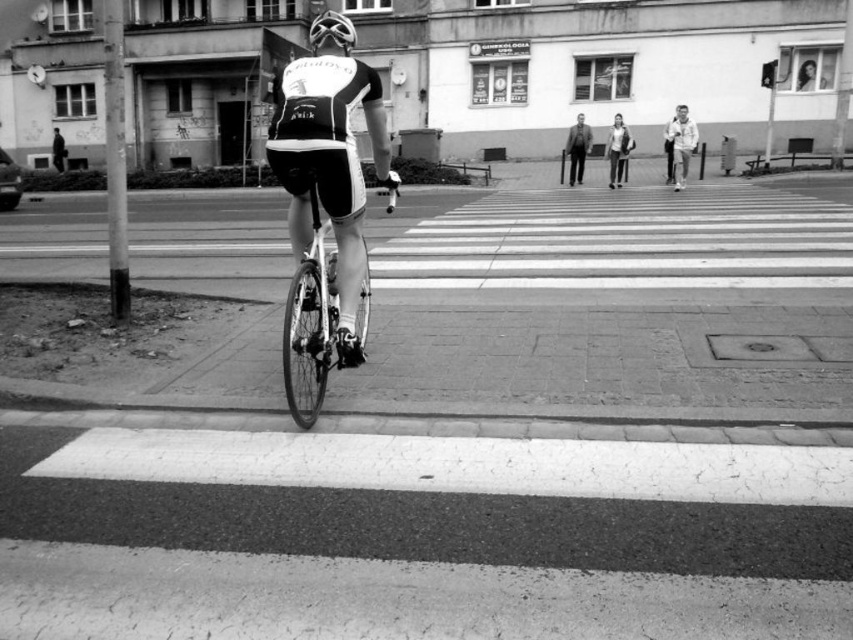
Does shiny metallic bicycle at center appear over light brown leather jacket at center?

No, shiny metallic bicycle at center is not above light brown leather jacket at center.

Who is shorter, shiny metallic bicycle at center or light brown leather jacket at center?

shiny metallic bicycle at center

Where is `shiny metallic bicycle at center`? shiny metallic bicycle at center is located at coordinates (311, 321).

Is light brown leather jacket at center to the left of shiny black helmet at center from the viewer's perspective?

No, light brown leather jacket at center is not to the left of shiny black helmet at center.

Does light brown leather jacket at center appear on the right side of shiny black helmet at center?

Correct, you'll find light brown leather jacket at center to the right of shiny black helmet at center.

The image size is (853, 640). Describe the element at coordinates (618, 150) in the screenshot. I see `light brown leather jacket at center` at that location.

Find the location of a particular element. The image size is (853, 640). light brown leather jacket at center is located at coordinates (618, 150).

How much distance is there between shiny metallic bicycle at center and dark gray suit at center?

shiny metallic bicycle at center is 10.20 meters away from dark gray suit at center.

Does shiny metallic bicycle at center appear over dark gray suit at center?

No, shiny metallic bicycle at center is not above dark gray suit at center.

Locate an element on the screen. The width and height of the screenshot is (853, 640). shiny metallic bicycle at center is located at coordinates (311, 321).

Image resolution: width=853 pixels, height=640 pixels. In order to click on shiny metallic bicycle at center in this screenshot , I will do `click(311, 321)`.